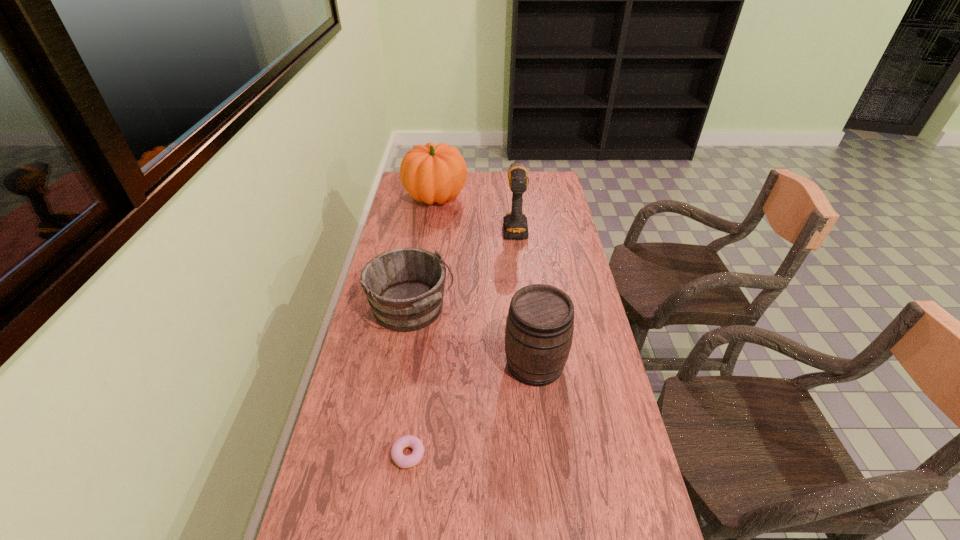
Identify the location of free space located 0.050m on the right of the pumpkin. (479, 197).

The width and height of the screenshot is (960, 540). What are the coordinates of `vacant space located 0.220m on the back of the right wine bucket` in the screenshot? It's located at (526, 292).

This screenshot has height=540, width=960. I want to click on vacant area situated on the back of the shorter wine bucket, so click(421, 247).

The height and width of the screenshot is (540, 960). Find the location of `vacant region located 0.180m on the right of the doughnut`. vacant region located 0.180m on the right of the doughnut is located at coordinates (497, 455).

The width and height of the screenshot is (960, 540). Find the location of `object that is at the far edge`. object that is at the far edge is located at coordinates (432, 173).

You are a GUI agent. You are given a task and a screenshot of the screen. Output one action in this format:
    pyautogui.click(x=<x>, y=<y>)
    Task: Click on the pumpkin that is at the left edge
    This screenshot has height=540, width=960.
    Given the screenshot: What is the action you would take?
    pyautogui.click(x=432, y=173)

I want to click on wine bucket positioned at the left edge, so pyautogui.click(x=405, y=287).

I want to click on doughnut that is at the left edge, so click(x=408, y=441).

Identify the location of object positioned at the right edge. The width and height of the screenshot is (960, 540). (539, 329).

The height and width of the screenshot is (540, 960). I want to click on object at the far left corner, so click(432, 173).